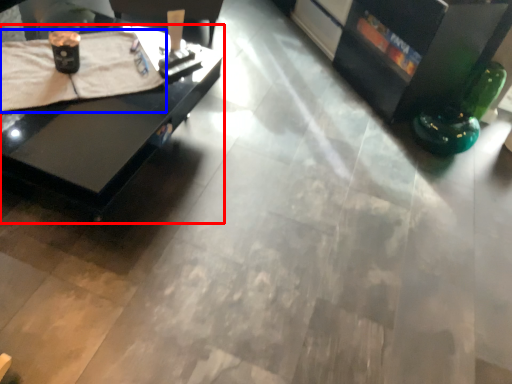
Question: Which of the following is the farthest to the observer, table (highlighted by a red box) or blanket (highlighted by a blue box)?

Choices:
 (A) table
 (B) blanket

Answer: (B)